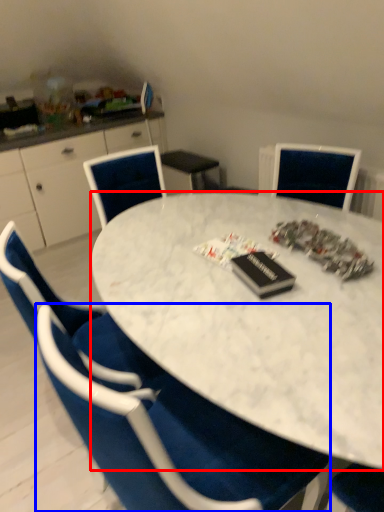
Question: Which object is further to the camera taking this photo, desk (highlighted by a red box) or chair (highlighted by a blue box)?

Choices:
 (A) desk
 (B) chair

Answer: (A)